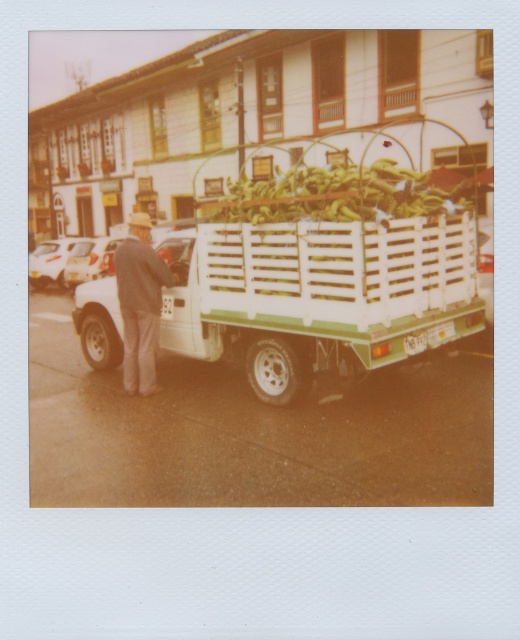
Describe the element at coordinates (339, 275) in the screenshot. I see `white wooden crate at center` at that location.

Is point (268, 314) closer to camera compared to point (140, 369)?

Yes, point (268, 314) is in front of point (140, 369).

This screenshot has width=520, height=640. What are the coordinates of `white wooden crate at center` in the screenshot? It's located at (339, 275).